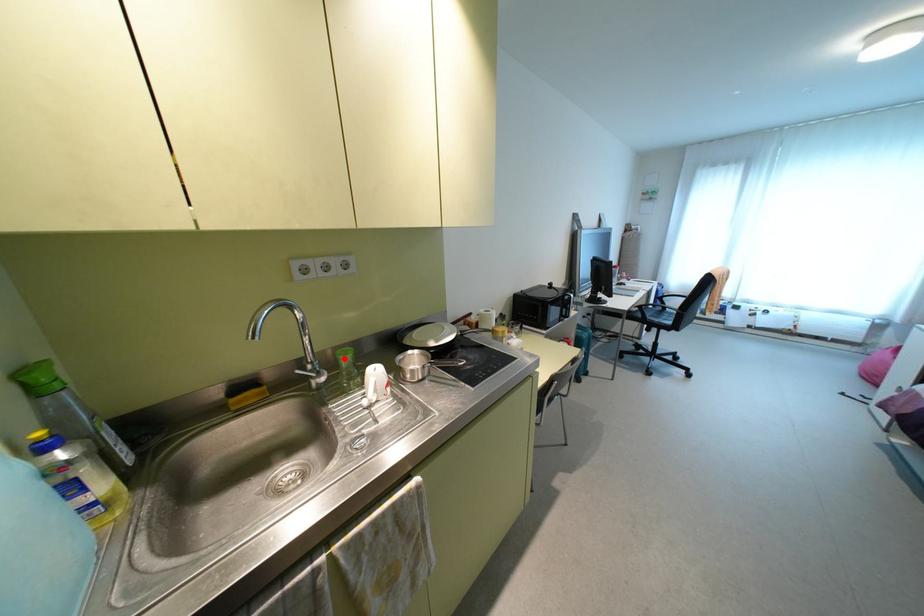
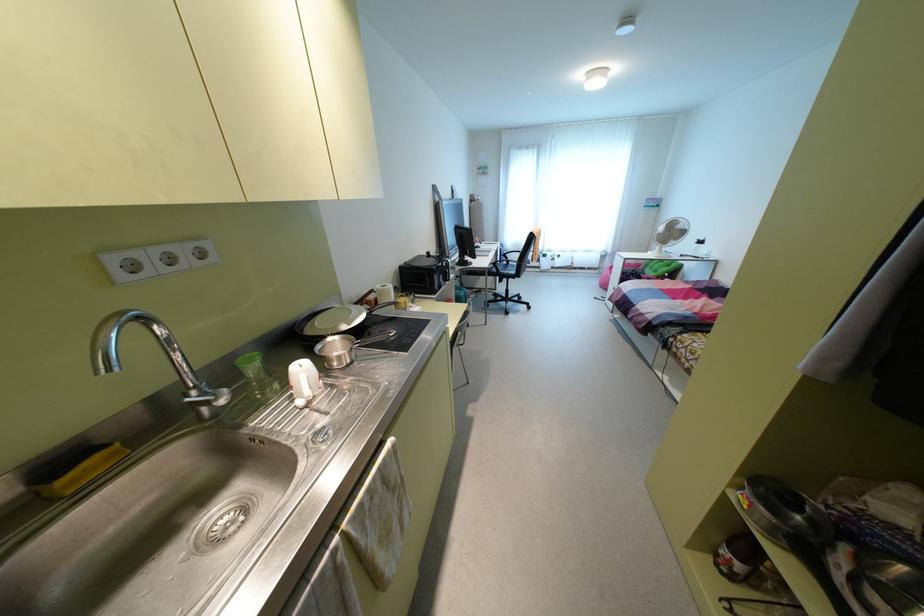
Question: I am providing you with two images of the same scene from different viewpoints. Image1 has a red point marked. In image2, the corresponding 3D location appears at what relative position? Reply with the corresponding letter.

Choices:
 (A) Closer
 (B) Farther

Answer: (B)